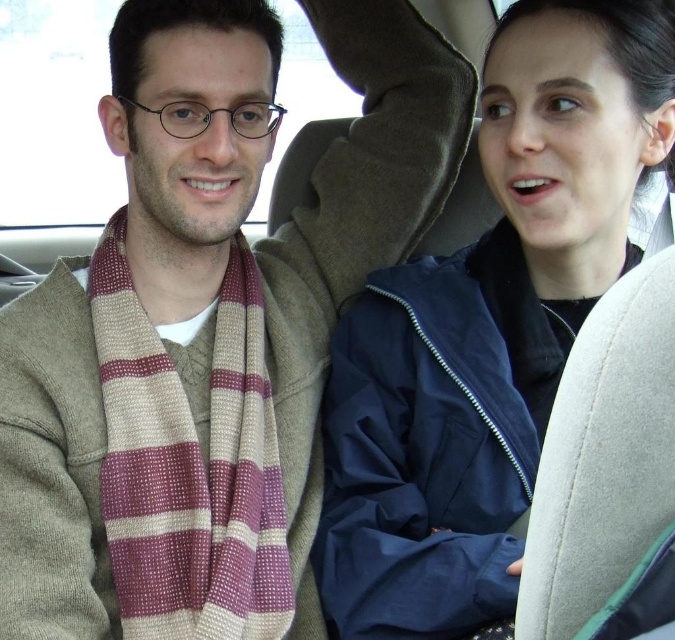
You are a fashion designer observing the car scene. You need to determine which item, the striped wool scarf at left or the navy blue jacket at upper right, would require more fabric to produce. Based on the scene, which one would you choose?

The striped wool scarf at left is larger in size than the navy blue jacket at upper right, so the striped wool scarf at left would require more fabric to produce.

You are a passenger in the car and want to retrieve your striped wool scarf at left from under the navy blue jacket at upper right. Is the scarf currently accessible?

The striped wool scarf at left is positioned over the navy blue jacket at upper right, meaning it is not under the jacket but rather placed above it. Therefore, the scarf is accessible without moving the jacket.